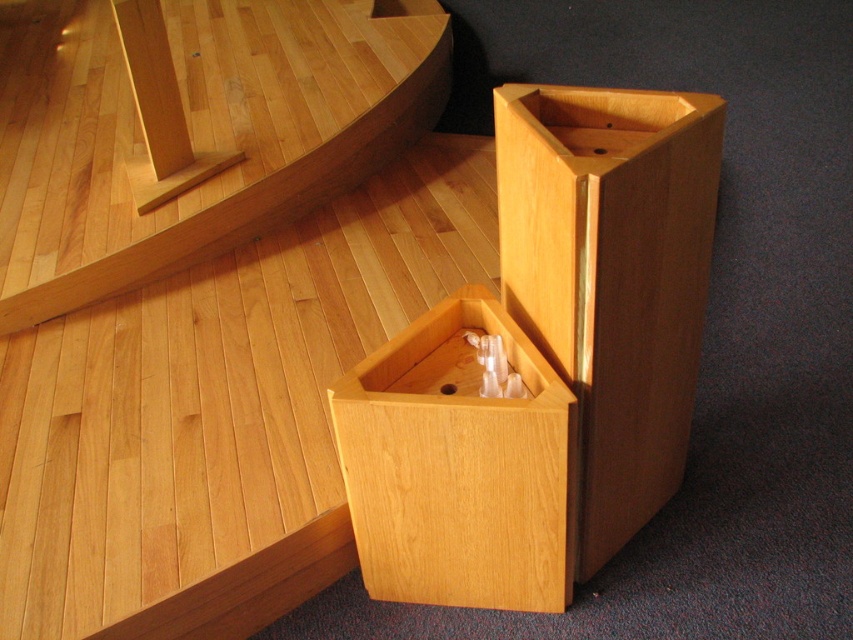
You are standing in the wooden interior space and want to determine which of the two points, point (129, 96) or point (540, 372), is closer to you. Based on the scene description, can you identify which point is nearer?

Point (129, 96) is further to the camera than point (540, 372). Therefore, point (540, 372) is closer to you.